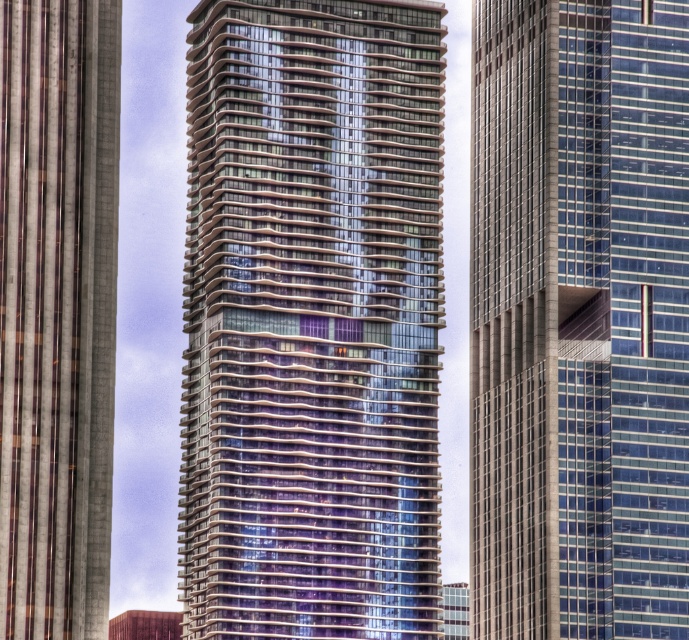
Which is more to the right, glassy reflective skyscraper at center or glassy steel skyscraper at center?

glassy steel skyscraper at center is more to the right.

Between point (333, 120) and point (668, 372), which one is positioned behind?

The point (668, 372) is behind.

I want to click on glassy reflective skyscraper at center, so click(x=311, y=320).

Which is more to the right, glassy reflective skyscraper at center or glassy reflective skyscraper at left?

glassy reflective skyscraper at center

Based on the photo, is glassy reflective skyscraper at center to the right of glassy reflective skyscraper at left from the viewer's perspective?

Indeed, glassy reflective skyscraper at center is positioned on the right side of glassy reflective skyscraper at left.

You are a GUI agent. You are given a task and a screenshot of the screen. Output one action in this format:
    pyautogui.click(x=<x>, y=<y>)
    Task: Click on the glassy reflective skyscraper at center
    
    Given the screenshot: What is the action you would take?
    pyautogui.click(x=311, y=320)

What are the coordinates of `glassy reflective skyscraper at center` in the screenshot? It's located at (311, 320).

Which is in front, point (633, 276) or point (83, 44)?

Point (83, 44)

Can you confirm if glassy steel skyscraper at center is wider than glassy reflective skyscraper at left?

Yes.

Locate an element on the screen. The height and width of the screenshot is (640, 689). glassy steel skyscraper at center is located at coordinates (577, 317).